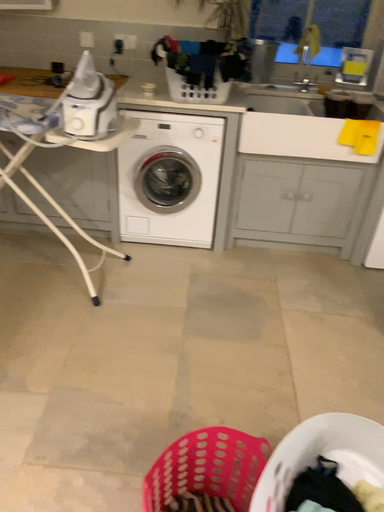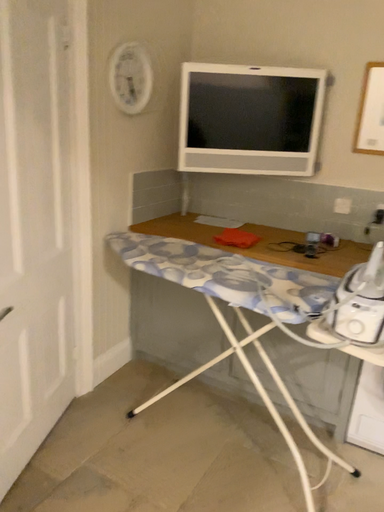
Question: Which way did the camera rotate in the video?

Choices:
 (A) rotated left
 (B) rotated right

Answer: (A)